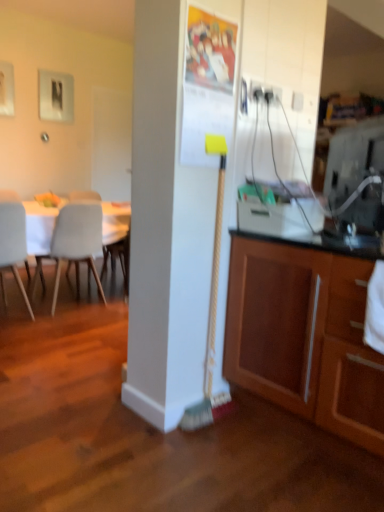
Question: Is light gray plastic chair at left, acting as the 2th chair starting from the left, to the left or to the right of white matte chair at left, which is counted as the 2th chair, starting from the right, in the image?

Choices:
 (A) left
 (B) right

Answer: (B)

Question: Based on their sizes in the image, would you say light gray plastic chair at left, acting as the 2th chair starting from the left, is bigger or smaller than white matte chair at left, which is counted as the 2th chair, starting from the right?

Choices:
 (A) small
 (B) big

Answer: (B)

Question: Estimate the real-world distances between objects in this image. Which object is closer to the yellow-bristled broom at center?

Choices:
 (A) light gray plastic chair at left, acting as the 2th chair starting from the left
 (B) wooden cabinet at lower right
 (C) white matte chair at left, which is counted as the 2th chair, starting from the right

Answer: (B)

Question: Based on their relative distances, which object is farther from the yellow-bristled broom at center?

Choices:
 (A) wooden cabinet at lower right
 (B) light gray plastic chair at left, acting as the 2th chair starting from the left
 (C) white matte chair at left, which is counted as the 2th chair, starting from the right

Answer: (B)